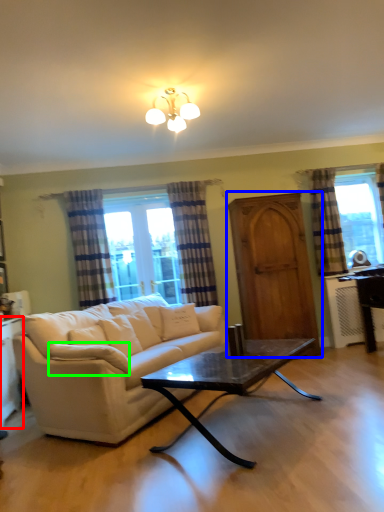
Question: Which object is positioned closest to cabinetry (highlighted by a red box)? Select from screen door (highlighted by a blue box) and pillow (highlighted by a green box).

Choices:
 (A) screen door
 (B) pillow

Answer: (B)